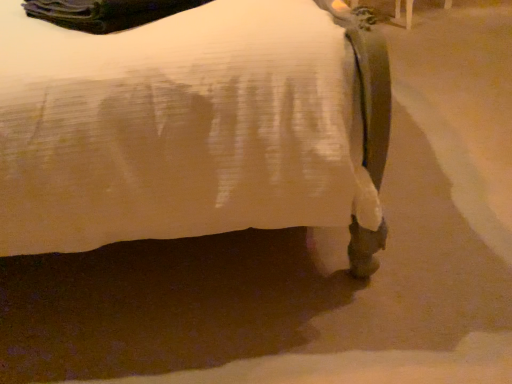
Question: From the image's perspective, is metallic silver bedpost at upper right on top of white matte bed at lower right?

Choices:
 (A) yes
 (B) no

Answer: (A)

Question: Is metallic silver bedpost at upper right with white matte bed at lower right?

Choices:
 (A) yes
 (B) no

Answer: (B)

Question: Is metallic silver bedpost at upper right bigger than white matte bed at lower right?

Choices:
 (A) no
 (B) yes

Answer: (A)

Question: From the image's perspective, is metallic silver bedpost at upper right under white matte bed at lower right?

Choices:
 (A) no
 (B) yes

Answer: (A)

Question: Is metallic silver bedpost at upper right thinner than white matte bed at lower right?

Choices:
 (A) yes
 (B) no

Answer: (A)

Question: Can you confirm if metallic silver bedpost at upper right is shorter than white matte bed at lower right?

Choices:
 (A) yes
 (B) no

Answer: (A)

Question: Is white matte bed at lower right positioned beyond the bounds of metallic silver bedpost at upper right?

Choices:
 (A) no
 (B) yes

Answer: (B)

Question: Is white matte bed at lower right next to metallic silver bedpost at upper right and touching it?

Choices:
 (A) no
 (B) yes

Answer: (A)

Question: From the image's perspective, is white matte bed at lower right located above metallic silver bedpost at upper right?

Choices:
 (A) no
 (B) yes

Answer: (A)

Question: Is white matte bed at lower right at the right side of metallic silver bedpost at upper right?

Choices:
 (A) yes
 (B) no

Answer: (B)

Question: From a real-world perspective, is white matte bed at lower right beneath metallic silver bedpost at upper right?

Choices:
 (A) no
 (B) yes

Answer: (A)

Question: Would you say white matte bed at lower right contains metallic silver bedpost at upper right?

Choices:
 (A) no
 (B) yes

Answer: (A)

Question: Is point (406, 28) positioned closer to the camera than point (78, 6)?

Choices:
 (A) farther
 (B) closer

Answer: (A)